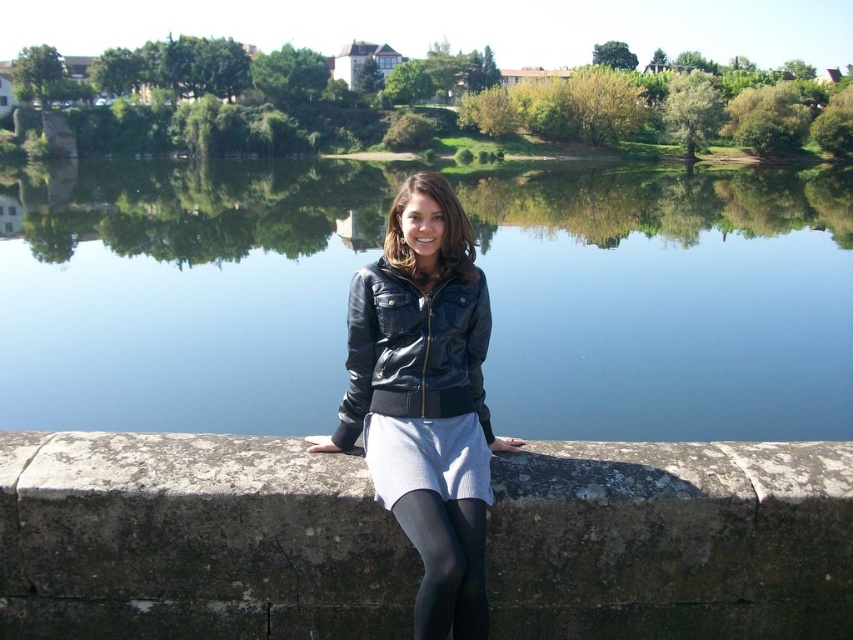
You are a photographer standing in front of the serene outdoor scene. You want to capture a photo that includes both the black leather jacket at center and the black tights at lower center. Which object should you focus on first to ensure both are in sharp focus?

You should focus on the black leather jacket at center first because it is closer to the viewer than the black tights at lower center, ensuring both will be in focus when focusing on the closer object.

You are a photographer trying to capture the reflection of the leather jacket at center in the transparent blue water at center. Can you confirm if the water is wide enough to fully capture the jacket in its reflection?

The transparent blue water at center might be wider than the leather jacket at center, so there is a possibility that the reflection could fully capture the jacket, but it depends on the exact dimensions and angles.